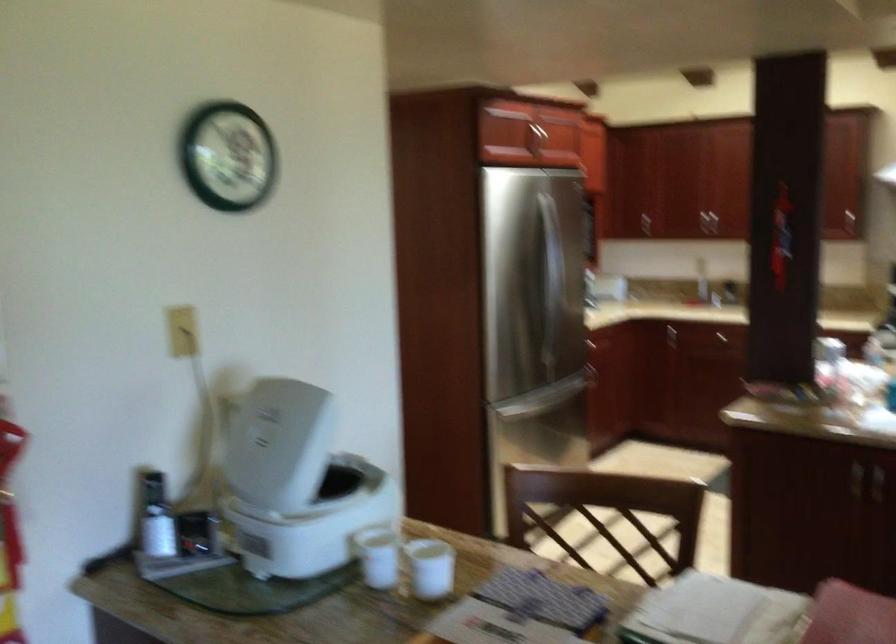
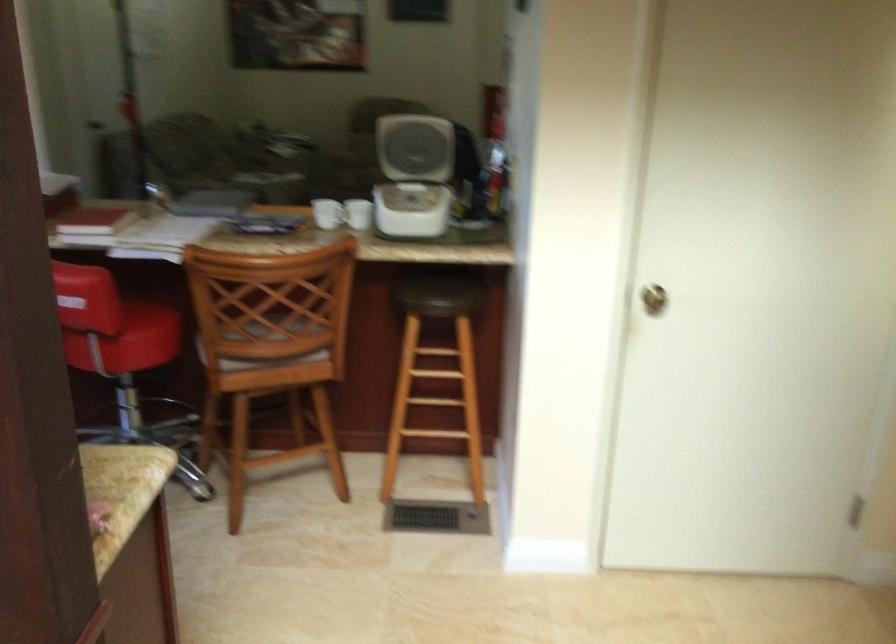
In the second image, find the point that corresponds to (255,444) in the first image.

(416, 137)